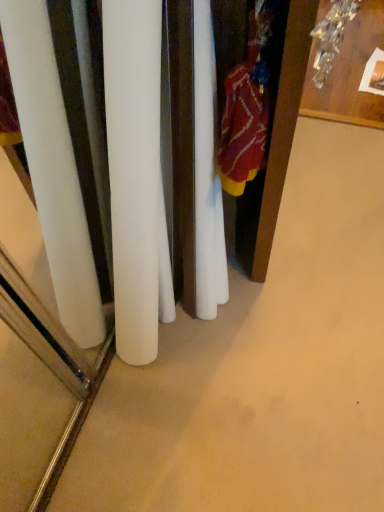
Question: Is wooden table at upper right thinner than knitted wool sweater at right?

Choices:
 (A) yes
 (B) no

Answer: (B)

Question: Is wooden table at upper right positioned behind knitted wool sweater at right?

Choices:
 (A) no
 (B) yes

Answer: (B)

Question: Can you confirm if wooden table at upper right is shorter than knitted wool sweater at right?

Choices:
 (A) no
 (B) yes

Answer: (B)

Question: Does wooden table at upper right lie in front of knitted wool sweater at right?

Choices:
 (A) yes
 (B) no

Answer: (B)

Question: Is wooden table at upper right positioned beyond the bounds of knitted wool sweater at right?

Choices:
 (A) yes
 (B) no

Answer: (A)

Question: Could you tell me if wooden table at upper right is facing knitted wool sweater at right?

Choices:
 (A) yes
 (B) no

Answer: (B)

Question: From a real-world perspective, is knitted wool sweater at right positioned over wooden armoire at right based on gravity?

Choices:
 (A) yes
 (B) no

Answer: (A)

Question: From the image's perspective, is knitted wool sweater at right beneath wooden armoire at right?

Choices:
 (A) no
 (B) yes

Answer: (B)

Question: Is knitted wool sweater at right oriented towards wooden armoire at right?

Choices:
 (A) yes
 (B) no

Answer: (A)

Question: Does knitted wool sweater at right have a lesser width compared to wooden armoire at right?

Choices:
 (A) no
 (B) yes

Answer: (B)

Question: From the image's perspective, is knitted wool sweater at right on top of wooden armoire at right?

Choices:
 (A) no
 (B) yes

Answer: (A)

Question: Is knitted wool sweater at right smaller than wooden armoire at right?

Choices:
 (A) no
 (B) yes

Answer: (B)

Question: Does wooden table at upper right lie in front of wooden armoire at right?

Choices:
 (A) yes
 (B) no

Answer: (B)